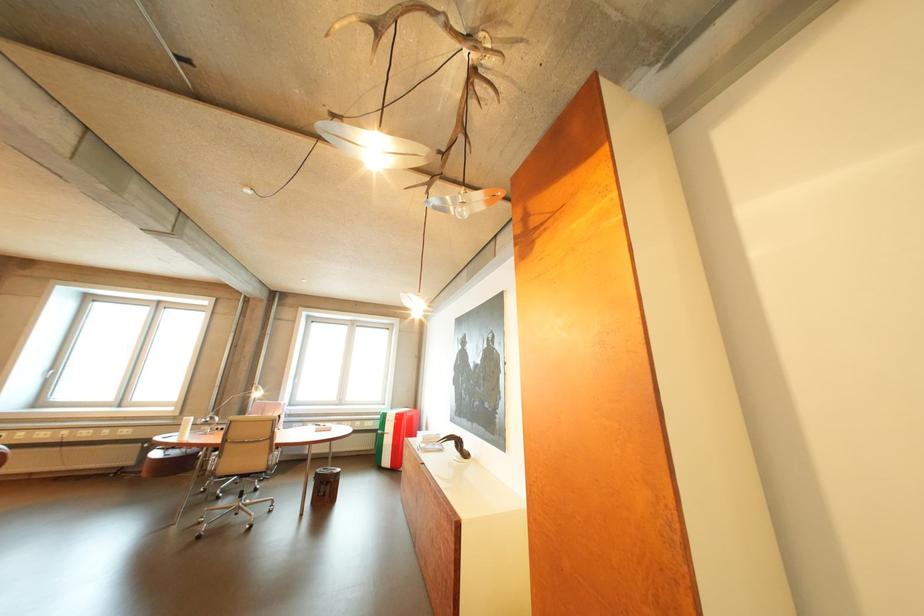
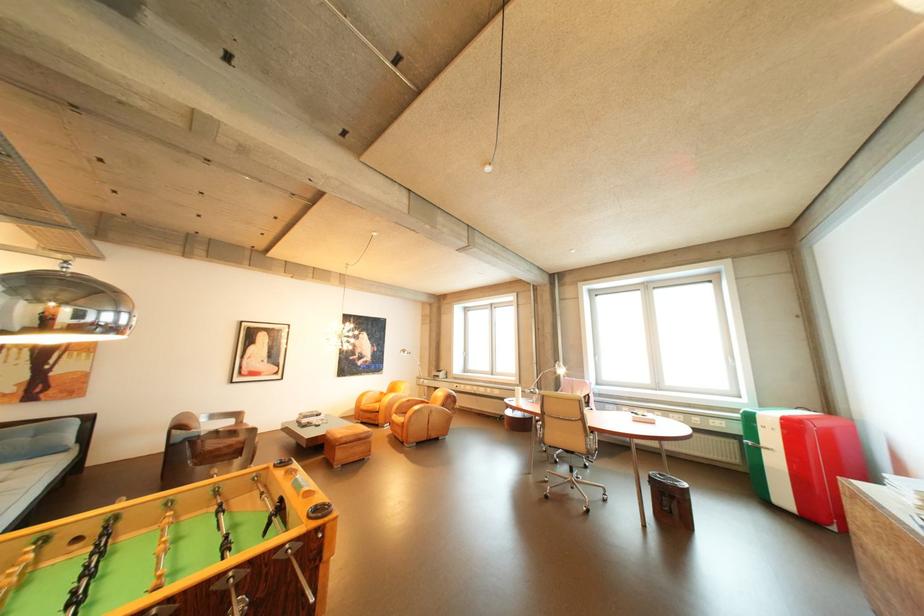
Question: How did the camera likely rotate?

Choices:
 (A) Left
 (B) Right
 (C) Up
 (D) Down

Answer: (A)